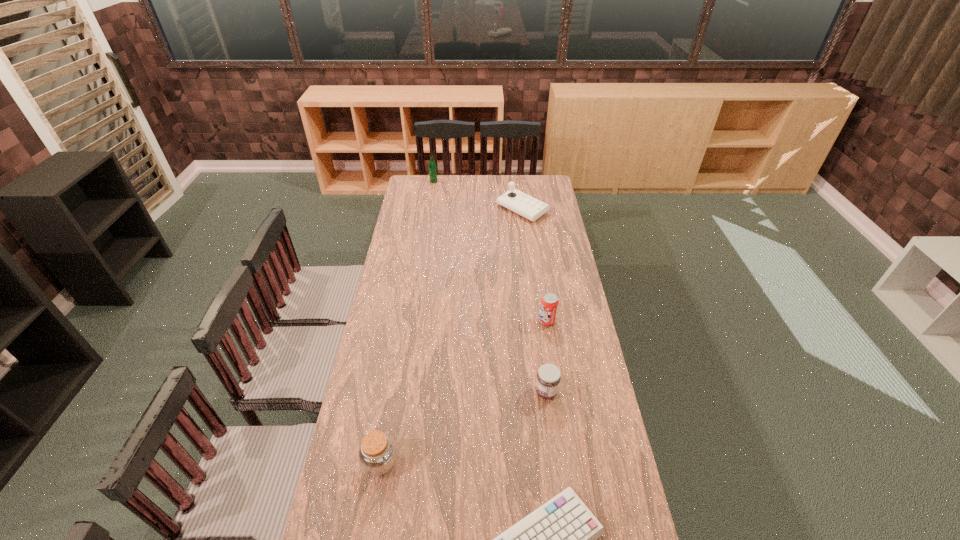
I want to click on free space located 0.190m on the right of the second nearest object, so click(x=461, y=463).

You are a GUI agent. You are given a task and a screenshot of the screen. Output one action in this format:
    pyautogui.click(x=<x>, y=<y>)
    Task: Click on the blank space located on the front label of the jam
    This screenshot has height=540, width=960.
    Given the screenshot: What is the action you would take?
    pyautogui.click(x=442, y=392)

You are a GUI agent. You are given a task and a screenshot of the screen. Output one action in this format:
    pyautogui.click(x=<x>, y=<y>)
    Task: Click on the vacant region located 0.310m on the front label of the jam
    
    Given the screenshot: What is the action you would take?
    pyautogui.click(x=447, y=392)

Where is `vacant space situated 0.090m on the front label of the jam`? vacant space situated 0.090m on the front label of the jam is located at coordinates (510, 392).

The width and height of the screenshot is (960, 540). In order to click on bottle at the far edge in this screenshot , I will do `click(432, 167)`.

The height and width of the screenshot is (540, 960). Identify the location of joystick that is positioned at the far edge. (527, 206).

Find the location of a particular element. bottle present at the left edge is located at coordinates (432, 167).

In order to click on jar present at the left edge in this screenshot , I will do `click(377, 454)`.

Where is `joystick positioned at the right edge`? joystick positioned at the right edge is located at coordinates (527, 206).

You are a GUI agent. You are given a task and a screenshot of the screen. Output one action in this format:
    pyautogui.click(x=<x>, y=<y>)
    Task: Click on the soda can that is at the right edge
    The height and width of the screenshot is (540, 960).
    Given the screenshot: What is the action you would take?
    pyautogui.click(x=549, y=302)